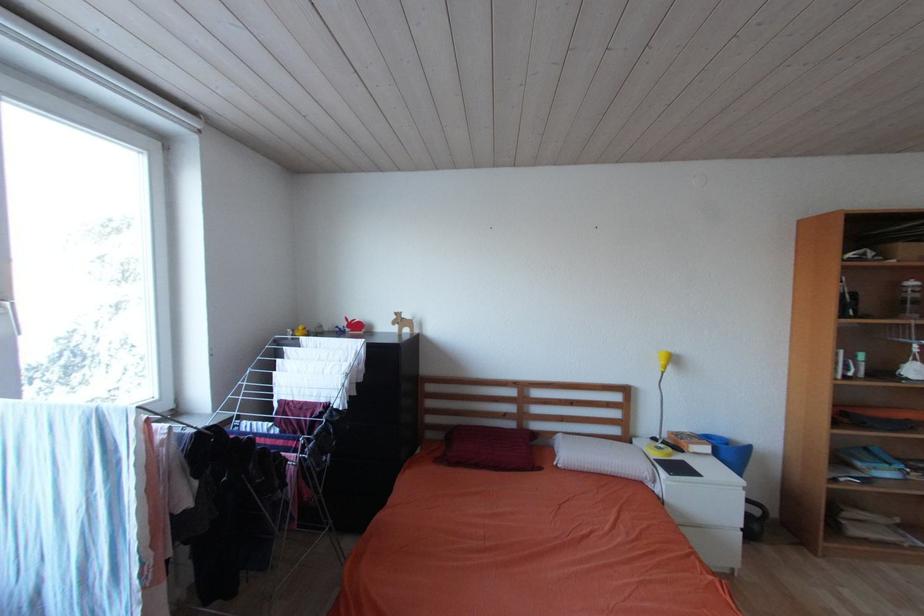
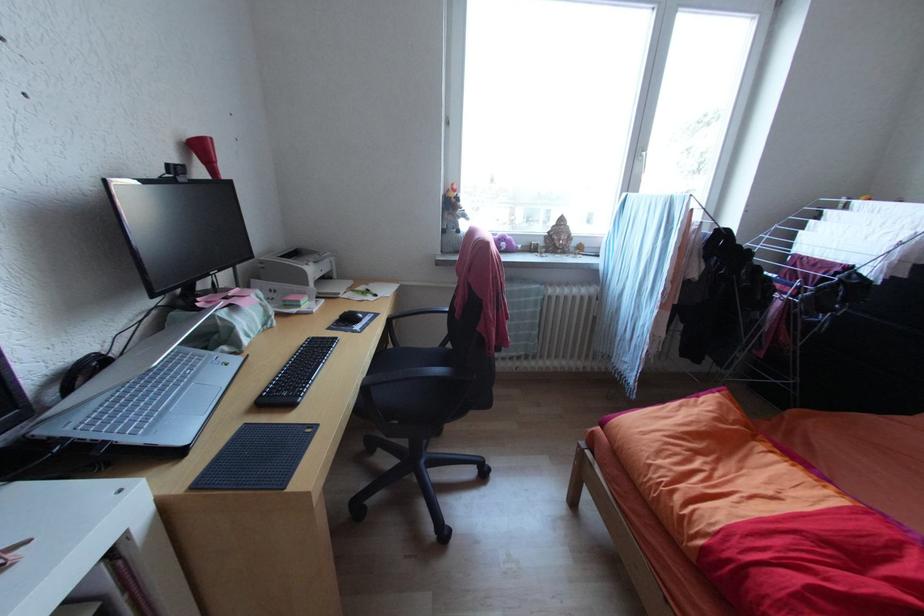
Based on the continuous images, in which direction is the camera rotating?

The camera rotated toward left-down.